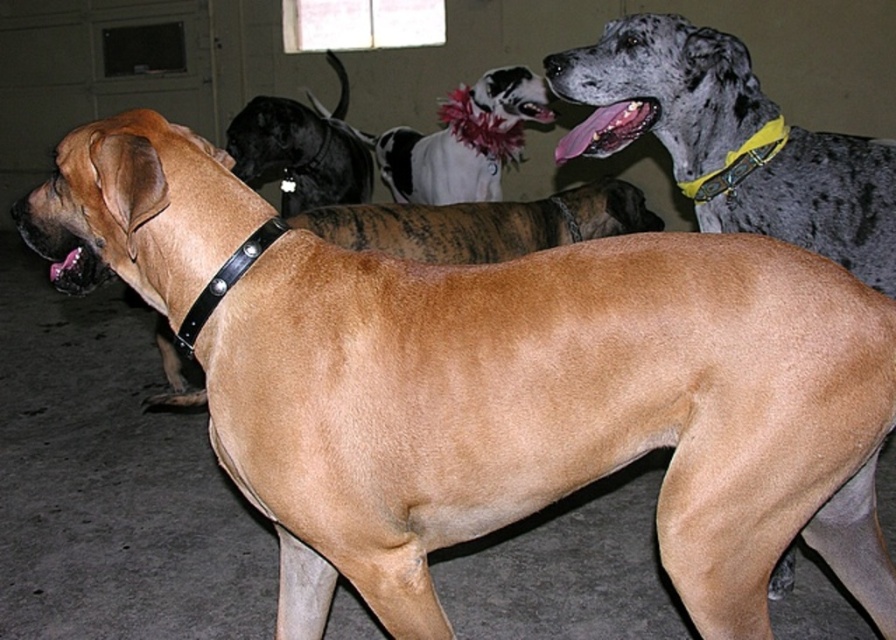
You are standing in the shelter and want to place a new poster on the wall between the two points labeled point (712, 225) and point (510, 122). Since the poster needs to be placed closer to the viewer, which point should you use as the reference for positioning the poster?

You should use point (712, 225) as the reference for positioning the poster because it is closer to the viewer than point (510, 122).

In the scene shown: You are standing in a dog shelter and want to approach the speckled fur dog at upper right. If you can reach out 6 feet, will you be able to touch it?

The speckled fur dog at upper right and viewer are 6.82 feet apart, so you cannot reach it with a 6 foot reach.